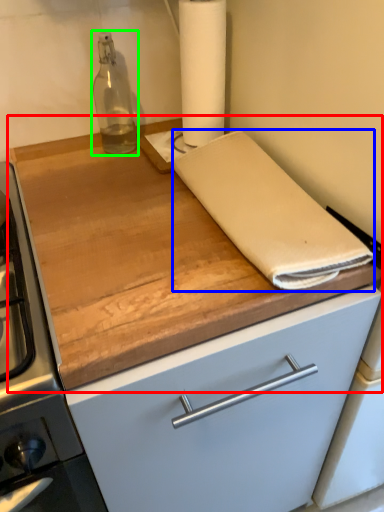
Question: Based on their relative distances, which object is nearer to countertop (highlighted by a red box)? Choose from linen (highlighted by a blue box) and bottle (highlighted by a green box).

Choices:
 (A) linen
 (B) bottle

Answer: (A)